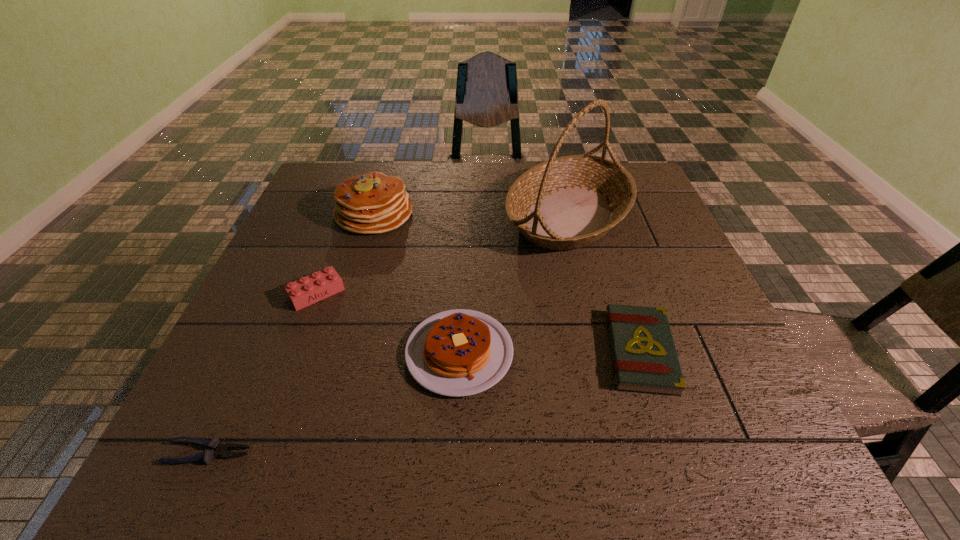
Find the location of a particular element. The image size is (960, 540). pliers that is at the left edge is located at coordinates (217, 449).

I want to click on basket that is positioned at the right edge, so click(568, 202).

In order to click on book at the right edge in this screenshot , I will do `click(644, 357)`.

Where is `object present at the far left corner`? object present at the far left corner is located at coordinates (372, 203).

The image size is (960, 540). In order to click on object that is positioned at the near left corner in this screenshot , I will do `click(217, 449)`.

Find the location of `object located in the far right corner section of the desktop`. object located in the far right corner section of the desktop is located at coordinates (568, 202).

Locate an element on the screen. This screenshot has height=540, width=960. vacant region at the far edge of the desktop is located at coordinates (444, 186).

In the image, there is a desktop. At what (x,y) coordinates should I click in order to perform the action: click on free space at the near edge. Please return your answer as a coordinate pair (x, y). This screenshot has width=960, height=540. Looking at the image, I should click on (367, 464).

In the image, there is a desktop. Where is `free space at the left edge`? The width and height of the screenshot is (960, 540). free space at the left edge is located at coordinates (314, 209).

In the image, there is a desktop. At what (x,y) coordinates should I click in order to perform the action: click on free space at the right edge. Please return your answer as a coordinate pair (x, y). The height and width of the screenshot is (540, 960). Looking at the image, I should click on (672, 295).